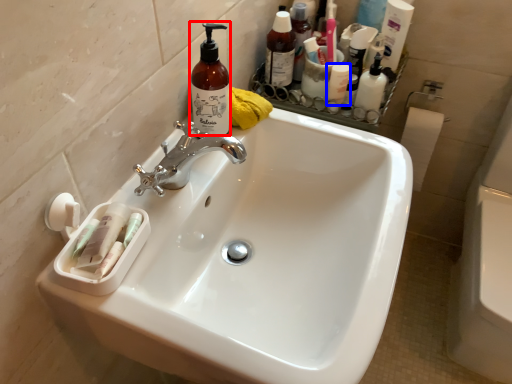
Question: Which of the following is the closest to the observer, cleaning product (highlighted by a red box) or mouthwash (highlighted by a blue box)?

Choices:
 (A) cleaning product
 (B) mouthwash

Answer: (A)